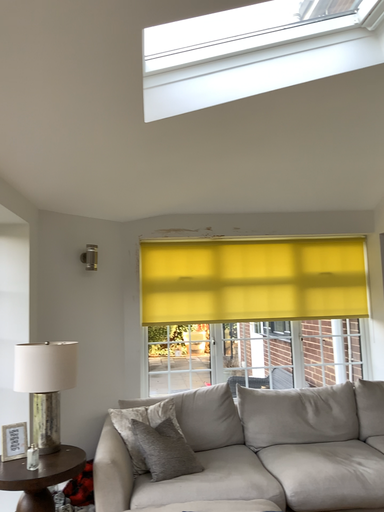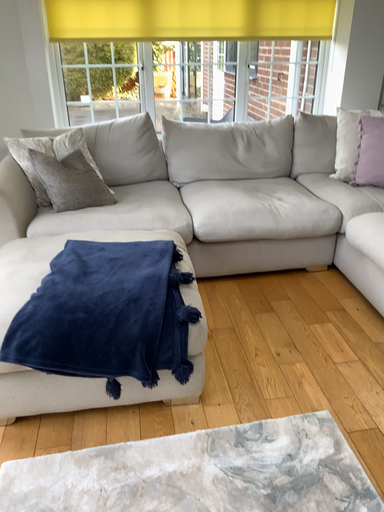
Question: How did the camera likely rotate when shooting the video?

Choices:
 (A) rotated upward
 (B) rotated downward

Answer: (B)